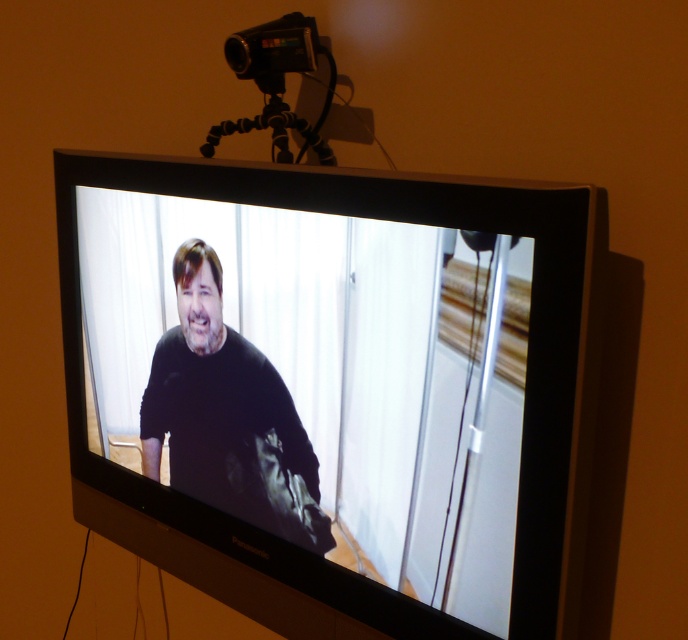
Question: Can you confirm if black plastic video camera at upper center is positioned below black rubber tripod at upper center?

Choices:
 (A) yes
 (B) no

Answer: (B)

Question: Estimate the real-world distances between objects in this image. Which object is closer to the black plastic video camera at upper center?

Choices:
 (A) black rubber tripod at upper center
 (B) black glossy tv at center

Answer: (A)

Question: Which object appears farthest from the camera in this image?

Choices:
 (A) black plastic video camera at upper center
 (B) black glossy tv at center

Answer: (A)

Question: Is black glossy tv at center further to camera compared to black rubber tripod at upper center?

Choices:
 (A) yes
 (B) no

Answer: (B)

Question: Is black plastic video camera at upper center to the right of black rubber tripod at upper center from the viewer's perspective?

Choices:
 (A) no
 (B) yes

Answer: (B)

Question: Which point appears farthest from the camera in this image?

Choices:
 (A) (385, 486)
 (B) (250, 352)
 (C) (283, 129)

Answer: (C)